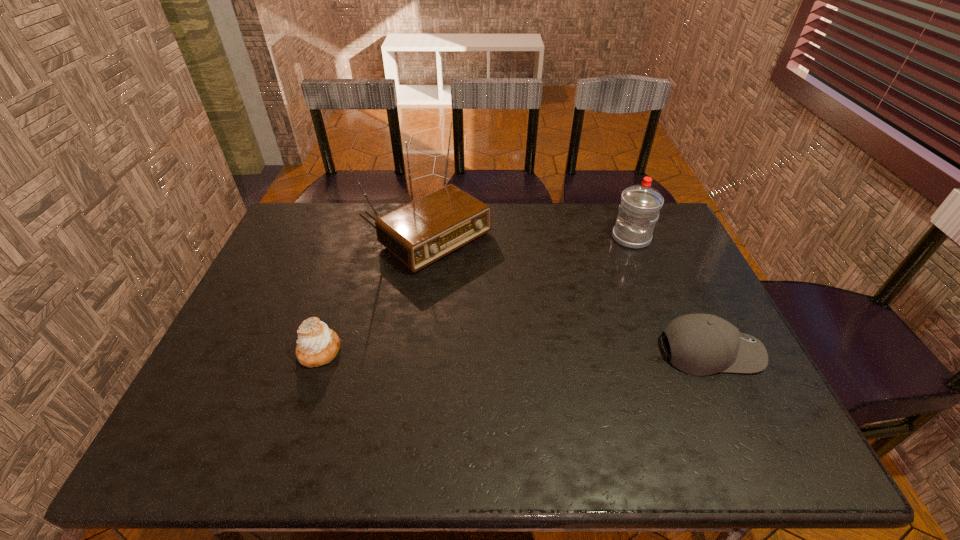
Locate an element on the screen. The image size is (960, 540). free point between the third tallest object and the pastry is located at coordinates (515, 351).

Select which object is the third closest to the second shortest object. Please provide its 2D coordinates. Your answer should be formatted as a tuple, i.e. [(x, y)], where the tuple contains the x and y coordinates of a point satisfying the conditions above.

[(317, 345)]

Identify which object is located as the second nearest to the shortest object. Please provide its 2D coordinates. Your answer should be formatted as a tuple, i.e. [(x, y)], where the tuple contains the x and y coordinates of a point satisfying the conditions above.

[(701, 344)]

Where is `vacant space that satisfies the following two spatial constraints: 1. on the back side of the radio_receiver; 2. on the left side of the shortest object`? This screenshot has width=960, height=540. vacant space that satisfies the following two spatial constraints: 1. on the back side of the radio_receiver; 2. on the left side of the shortest object is located at coordinates (357, 237).

You are a GUI agent. You are given a task and a screenshot of the screen. Output one action in this format:
    pyautogui.click(x=<x>, y=<y>)
    Task: Click on the free point that satisfies the following two spatial constraints: 1. on the front side of the pastry; 2. on the front brim of the second shortest object
    Image resolution: width=960 pixels, height=540 pixels.
    Given the screenshot: What is the action you would take?
    pyautogui.click(x=320, y=352)

You are a GUI agent. You are given a task and a screenshot of the screen. Output one action in this format:
    pyautogui.click(x=<x>, y=<y>)
    Task: Click on the free space that satisfies the following two spatial constraints: 1. on the back side of the tallest object; 2. on the right side of the pastry
    The image size is (960, 540).
    Given the screenshot: What is the action you would take?
    pyautogui.click(x=357, y=237)